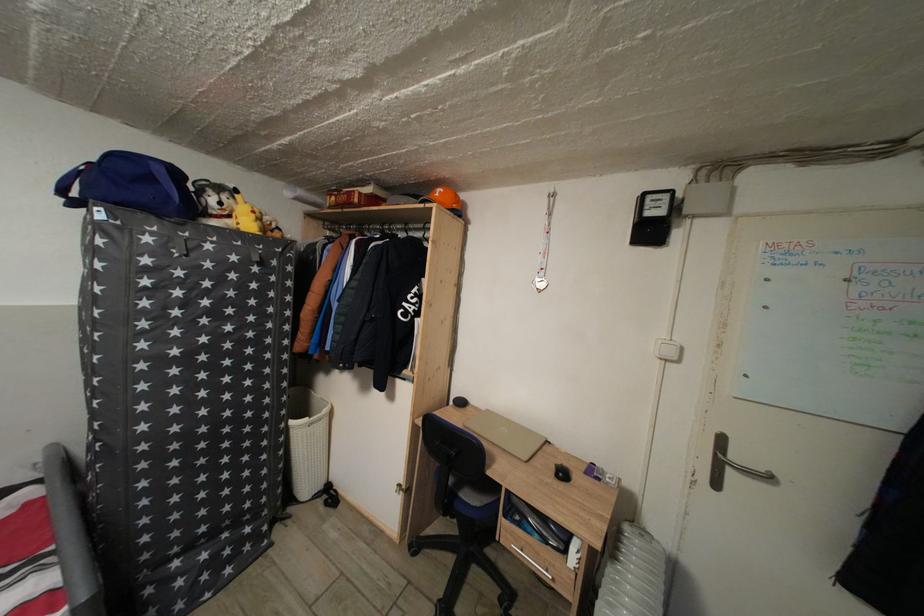
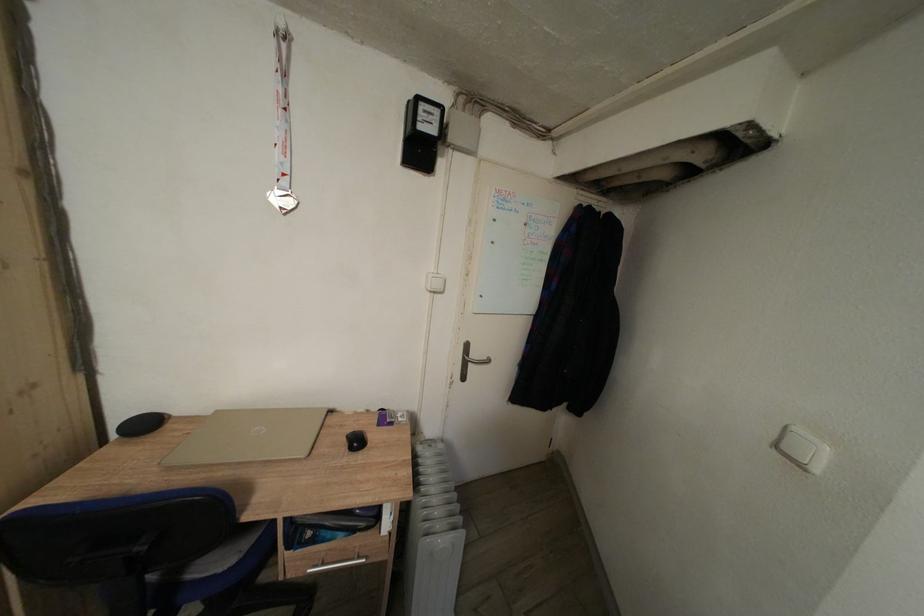
Question: The camera is either moving clockwise (left) or counter-clockwise (right) around the object. The first image is from the beginning of the video and the second image is from the end. Is the camera moving left or right when shooting the video?

Choices:
 (A) Left
 (B) Right

Answer: (A)